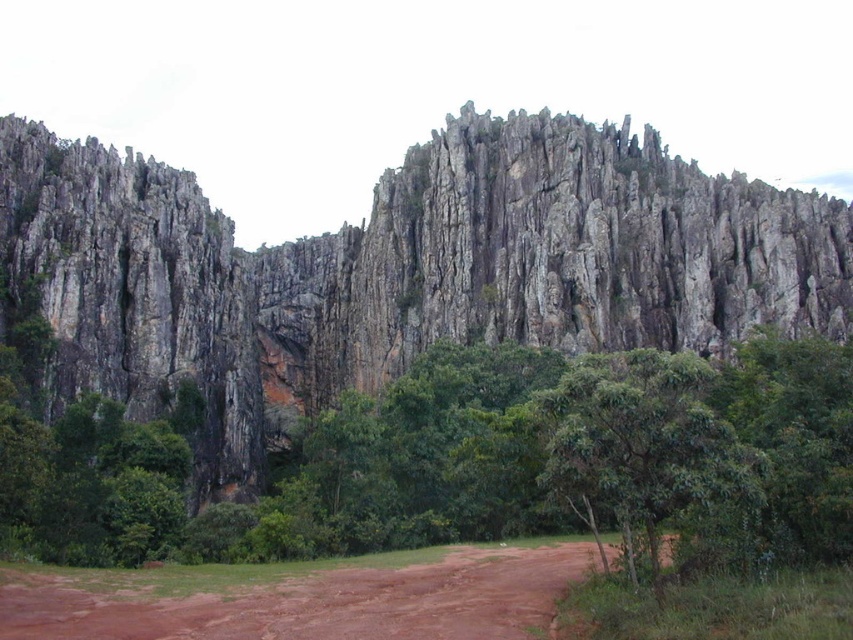
The width and height of the screenshot is (853, 640). Find the location of `rugged stone mountain at center`. rugged stone mountain at center is located at coordinates (402, 268).

This screenshot has width=853, height=640. Describe the element at coordinates (402, 268) in the screenshot. I see `rugged stone mountain at center` at that location.

In order to click on rugged stone mountain at center in this screenshot , I will do `click(402, 268)`.

Which is above, rugged stone mountain at center or green leafy tree at center?

Positioned higher is rugged stone mountain at center.

Between rugged stone mountain at center and green leafy tree at center, which one is positioned lower?

green leafy tree at center is below.

Between point (44, 166) and point (817, 477), which one is positioned in front?

Point (817, 477) is in front.

Locate an element on the screen. rugged stone mountain at center is located at coordinates (402, 268).

Is rugged stone mountain at center above green leafy tree at lower right?

Indeed, rugged stone mountain at center is positioned over green leafy tree at lower right.

Who is taller, rugged stone mountain at center or green leafy tree at lower right?

rugged stone mountain at center

What do you see at coordinates (402, 268) in the screenshot?
I see `rugged stone mountain at center` at bounding box center [402, 268].

Find the location of a particular element. The height and width of the screenshot is (640, 853). rugged stone mountain at center is located at coordinates (402, 268).